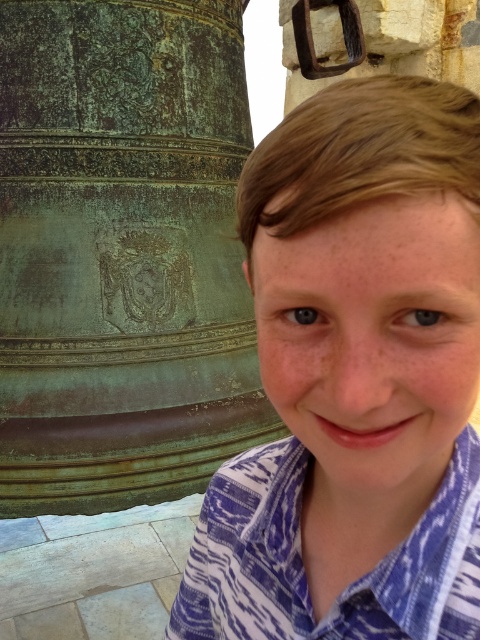
Question: Which object appears farthest from the camera in this image?

Choices:
 (A) blue printed shirt at right
 (B) green patina bell at left

Answer: (B)

Question: Considering the relative positions of matte bronze bell at left and green patina bell at left in the image provided, where is matte bronze bell at left located with respect to green patina bell at left?

Choices:
 (A) left
 (B) right

Answer: (B)

Question: From the image, what is the correct spatial relationship of green patina bell at left in relation to blue printed shirt at right?

Choices:
 (A) right
 (B) left

Answer: (B)

Question: Which object is positioned closest to the matte bronze bell at left?

Choices:
 (A) blue printed shirt at right
 (B) green patina bell at left

Answer: (A)

Question: Is green patina bell at left wider than blue printed shirt at right?

Choices:
 (A) no
 (B) yes

Answer: (B)

Question: Among these points, which one is nearest to the camera?

Choices:
 (A) (160, 60)
 (B) (310, 248)
 (C) (300, 452)

Answer: (B)